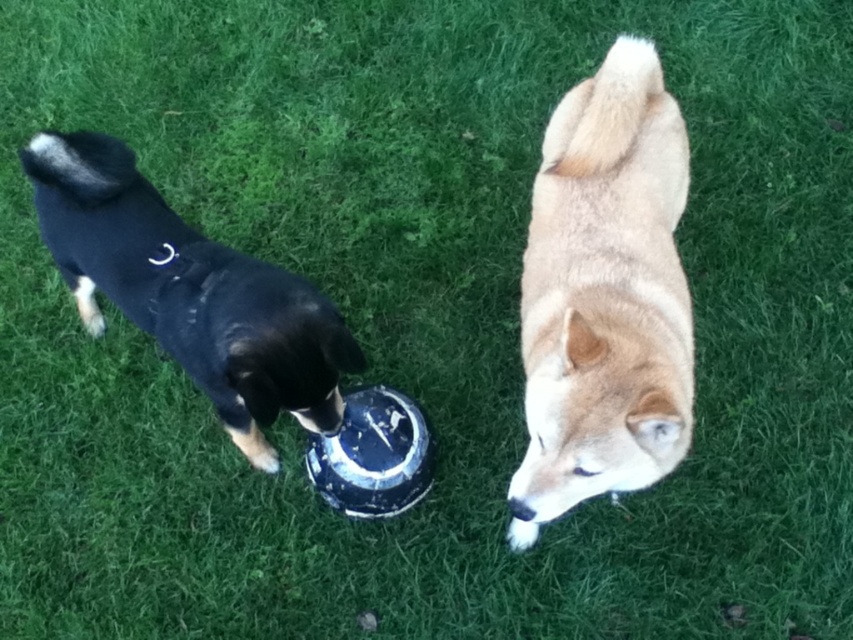
You are a dog trainer observing two dogs in a park. You see a light brown fur dog at upper right and a black matte dog at left. Which dog is taller?

The light brown fur dog at upper right is taller than the black matte dog at left.

You are a photographer trying to capture a photo of both dogs in the scene. You are standing at the center of the grassy area. Which direction should you move to ensure both the light brown fur dog at upper right and the black matte dog at left are visible in your frame?

Since the light brown fur dog at upper right is to the right of the black matte dog at left, you should move to the left to ensure both dogs are visible in your frame.

You are standing at the center of the grassy area and want to retrieve the frisbee. Which direction should you move to reach the frisbee first, considering the positions of the light brown fur dog at upper right and the black dog with tan markings on the left?

The black dog with tan markings on the left is closer to the frisbee, so you should move towards the left to reach the frisbee first before the light brown fur dog at upper right.